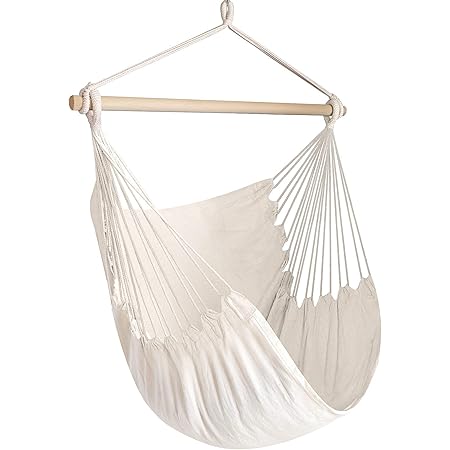
Identify the location of right end of wooden rod. (345, 111).